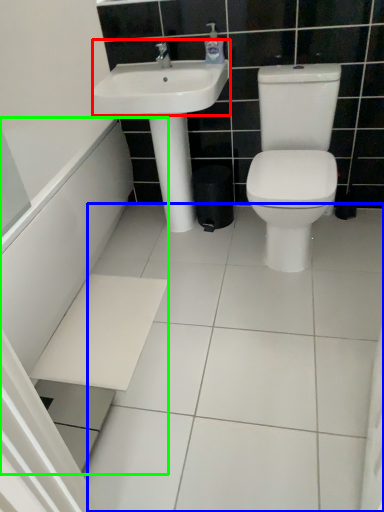
Question: Estimate the real-world distances between objects in this image. Which object is closer to sink (highlighted by a red box), ceramic tile (highlighted by a blue box) or bath (highlighted by a green box)?

Choices:
 (A) ceramic tile
 (B) bath

Answer: (B)